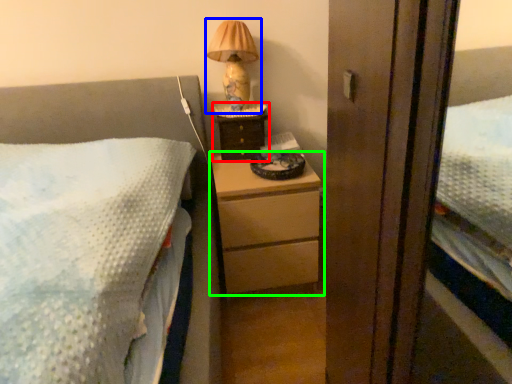
Question: Considering the real-world distances, which object is farthest from nightstand (highlighted by a red box)? table lamp (highlighted by a blue box) or chest of drawers (highlighted by a green box)?

Choices:
 (A) table lamp
 (B) chest of drawers

Answer: (B)